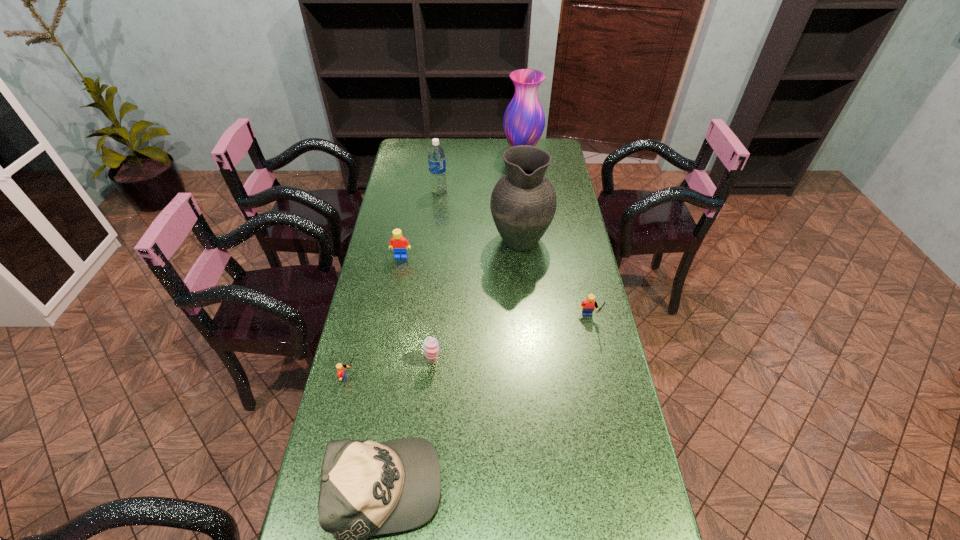
The width and height of the screenshot is (960, 540). I want to click on vase, so click(x=524, y=121).

I want to click on purple vase, so click(x=524, y=121).

Where is `pitcher`? pitcher is located at coordinates (523, 203).

What are the coordinates of `the third tallest object` in the screenshot? It's located at (436, 156).

Where is `the second farthest object`? This screenshot has height=540, width=960. the second farthest object is located at coordinates (436, 156).

You are a GUI agent. You are given a task and a screenshot of the screen. Output one action in this format:
    pyautogui.click(x=<x>, y=<y>)
    Task: Click on the second Lego from left to right
    
    Given the screenshot: What is the action you would take?
    pyautogui.click(x=398, y=243)

This screenshot has width=960, height=540. In order to click on the farthest Lego in this screenshot , I will do `click(398, 243)`.

Find the location of a particular element. The image size is (960, 540). the bigger yellow Lego is located at coordinates (588, 305).

Image resolution: width=960 pixels, height=540 pixels. Identify the location of the farther yellow Lego. (588, 305).

Identify the location of the sixth farthest object. Image resolution: width=960 pixels, height=540 pixels. (430, 346).